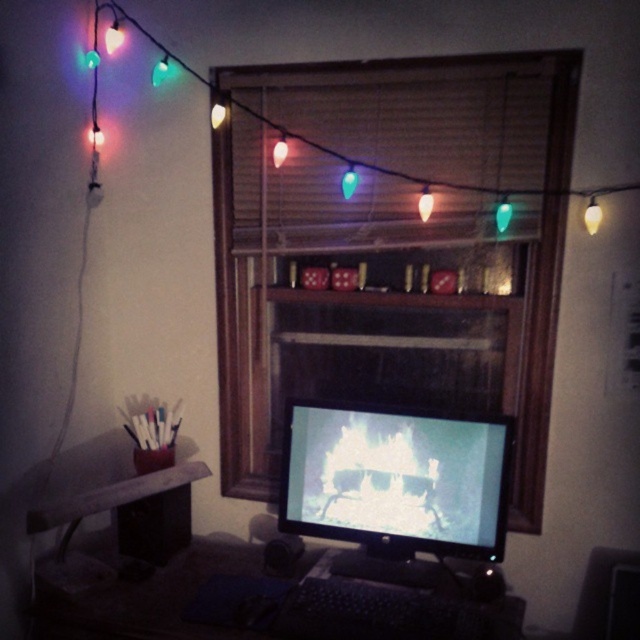
Question: Can you confirm if matte black monitor at center is positioned above wooden at left?

Choices:
 (A) yes
 (B) no

Answer: (A)

Question: Does wooden at left have a greater width compared to green translucent bulb at center?

Choices:
 (A) yes
 (B) no

Answer: (A)

Question: Which of the following is the closest to the observer?

Choices:
 (A) black plastic keyboard at lower center
 (B) green glass bulb at upper center
 (C) wooden at left

Answer: (A)

Question: Is wooden at left above green glass bulb at upper center?

Choices:
 (A) yes
 (B) no

Answer: (B)

Question: Which point appears farthest from the camera in this image?

Choices:
 (A) (205, 540)
 (B) (234, 346)

Answer: (A)

Question: Estimate the real-world distances between objects in this image. Which object is farther from the wooden at left?

Choices:
 (A) matte black monitor at center
 (B) black plastic keyboard at lower center
 (C) wooden frame at center
 (D) green glass bulb at upper center

Answer: (D)